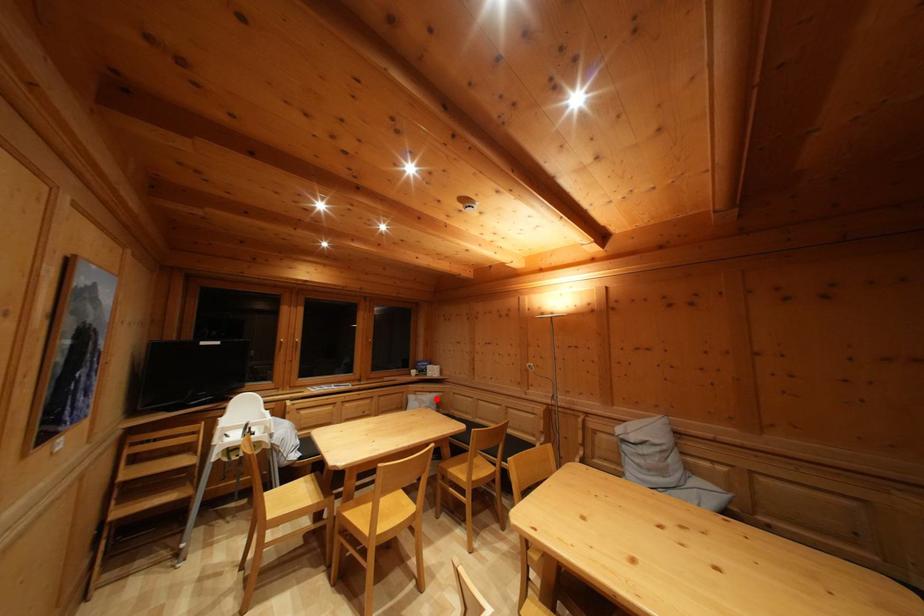
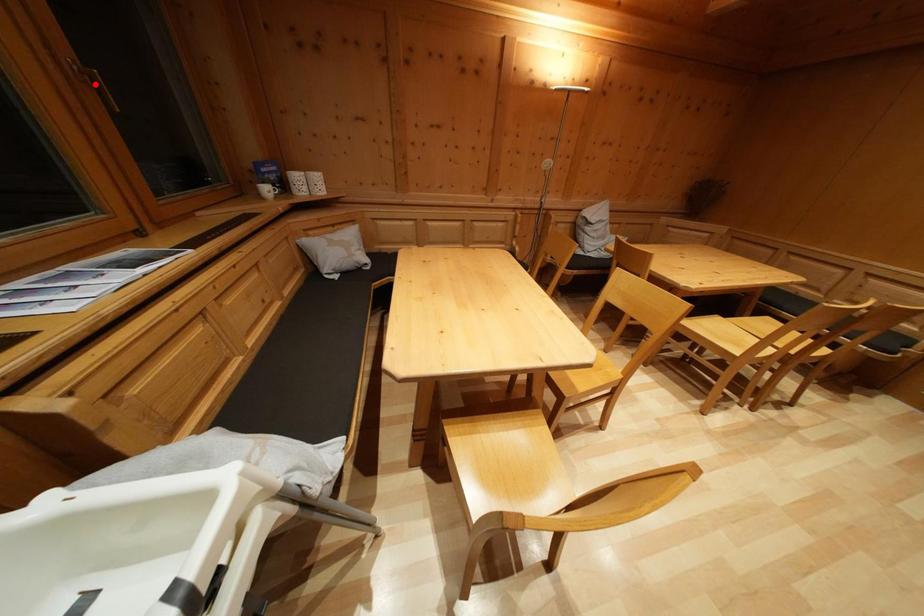
I am providing you with two images of the same scene from different viewpoints. A red point is marked on the first image and another point is marked on the second image. Do the highlighted points in image1 and image2 indicate the same real-world spot?

No